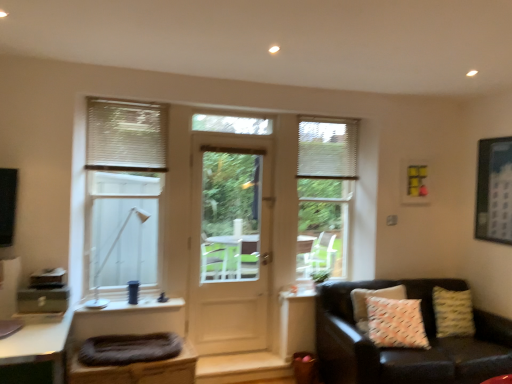
Question: Is metallic silver picture frame at upper right, which is counted as the 2th picture frame, starting from the left, oriented towards white textured pillow at right?

Choices:
 (A) no
 (B) yes

Answer: (A)

Question: Does metallic silver picture frame at upper right, the second picture frame from the back, have a lesser height compared to white textured pillow at right?

Choices:
 (A) yes
 (B) no

Answer: (B)

Question: Considering the relative sizes of metallic silver picture frame at upper right, which is counted as the 2th picture frame, starting from the left, and white textured pillow at right in the image provided, is metallic silver picture frame at upper right, which is counted as the 2th picture frame, starting from the left, bigger than white textured pillow at right?

Choices:
 (A) no
 (B) yes

Answer: (A)

Question: Would you consider metallic silver picture frame at upper right, which is counted as the 2th picture frame, starting from the left, to be distant from white textured pillow at right?

Choices:
 (A) yes
 (B) no

Answer: (A)

Question: From the image's perspective, would you say metallic silver picture frame at upper right, which appears as the 1th picture frame when viewed from the right, is positioned over white textured pillow at right?

Choices:
 (A) yes
 (B) no

Answer: (A)

Question: Does metallic silver picture frame at upper right, which is counted as the 2th picture frame, starting from the left, have a smaller size compared to white textured pillow at right?

Choices:
 (A) yes
 (B) no

Answer: (A)

Question: Is metallic silver picture frame at upper right, the second picture frame from the back, to the left of white plastic lamp at left from the viewer's perspective?

Choices:
 (A) yes
 (B) no

Answer: (B)

Question: From a real-world perspective, is metallic silver picture frame at upper right, which appears as the 1th picture frame when viewed from the right, positioned under white plastic lamp at left based on gravity?

Choices:
 (A) yes
 (B) no

Answer: (B)

Question: Is white plastic lamp at left surrounded by metallic silver picture frame at upper right, which is counted as the 2th picture frame, starting from the left?

Choices:
 (A) no
 (B) yes

Answer: (A)

Question: Can you confirm if metallic silver picture frame at upper right, which ranks as the 1th picture frame in front-to-back order, is taller than white plastic lamp at left?

Choices:
 (A) yes
 (B) no

Answer: (A)

Question: Does metallic silver picture frame at upper right, which appears as the 1th picture frame when viewed from the right, have a larger size compared to white plastic lamp at left?

Choices:
 (A) no
 (B) yes

Answer: (A)

Question: From the image's perspective, is metallic silver picture frame at upper right, the second picture frame from the back, below white plastic lamp at left?

Choices:
 (A) yes
 (B) no

Answer: (B)

Question: Is white textured blinds at upper left, the 2th shutter from the right, touching white blinds at center, positioned as the 2th window in front-to-back order?

Choices:
 (A) yes
 (B) no

Answer: (B)